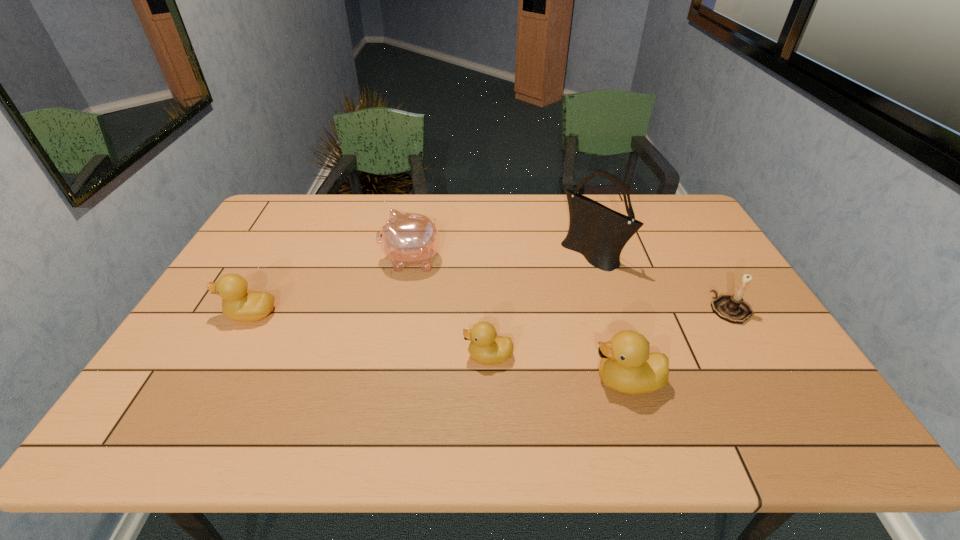
Identify the location of duckling that is the closest to the rightmost duckling. (486, 347).

You are a GUI agent. You are given a task and a screenshot of the screen. Output one action in this format:
    pyautogui.click(x=<x>, y=<y>)
    Task: Click on the second closest duckling to the shortest duckling
    The width and height of the screenshot is (960, 540).
    Given the screenshot: What is the action you would take?
    pyautogui.click(x=242, y=305)

I want to click on free space in the image that satisfies the following two spatial constraints: 1. on the front side of the rightmost object; 2. on the face of the rightmost duckling, so click(x=773, y=381).

Find the location of a particular element. free location that satisfies the following two spatial constraints: 1. on the front facing side of the rightmost object; 2. on the left side of the piggy bank is located at coordinates (402, 309).

Image resolution: width=960 pixels, height=540 pixels. I want to click on blank area in the image that satisfies the following two spatial constraints: 1. on the front side of the tallest object; 2. on the front facing side of the fifth object from right to left, so click(594, 260).